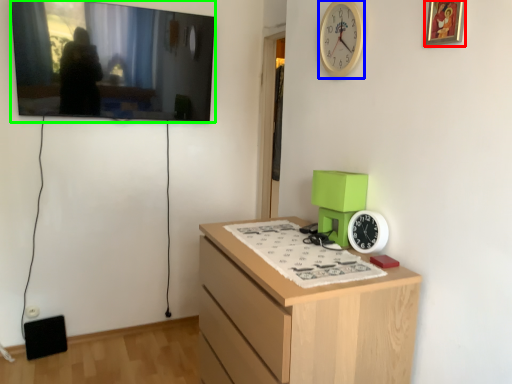
Question: Which object is positioned closest to picture frame (highlighted by a red box)? Select from clock (highlighted by a blue box) and picture frame (highlighted by a green box).

Choices:
 (A) clock
 (B) picture frame

Answer: (A)